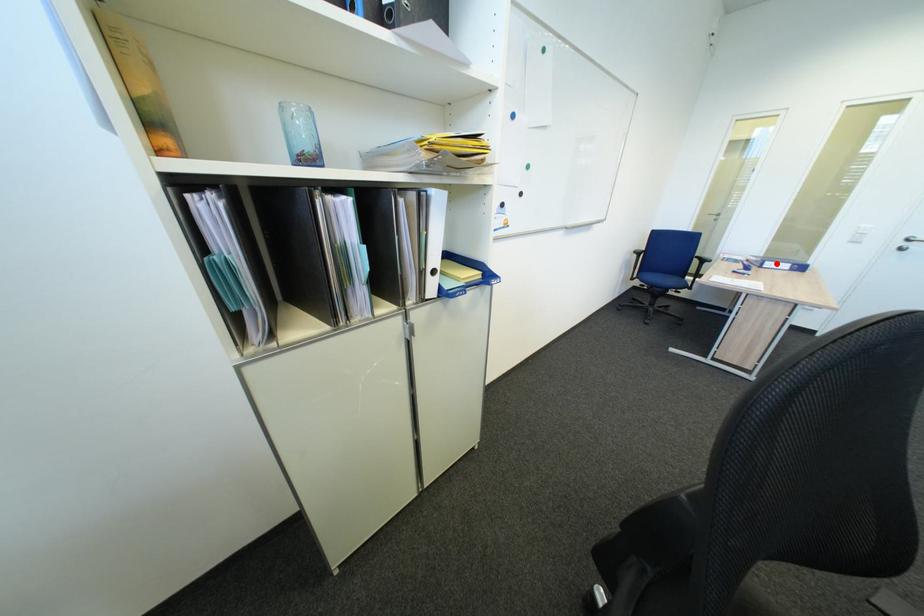
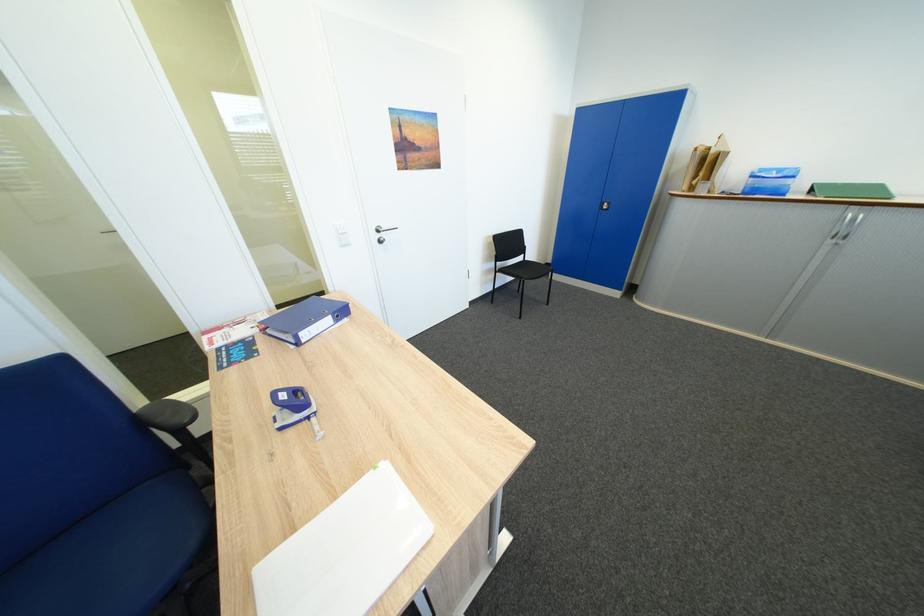
Locate, in the second image, the point that corresponds to the highlighted location in the first image.

(310, 334)